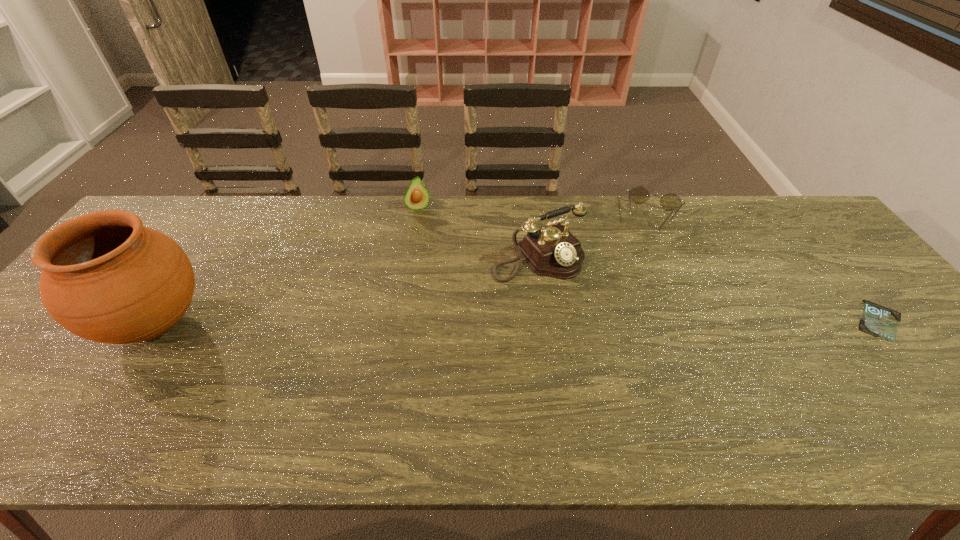
The width and height of the screenshot is (960, 540). I want to click on free space between the telephone and the leftmost object, so click(347, 290).

The image size is (960, 540). Identify the location of object identified as the third closest to the fourth object from left to right. (416, 197).

Select which object appears as the third closest to the third tallest object. Please provide its 2D coordinates. Your answer should be formatted as a tuple, i.e. [(x, y)], where the tuple contains the x and y coordinates of a point satisfying the conditions above.

[(639, 194)]

Find the location of a particular element. The width and height of the screenshot is (960, 540). vacant region that satisfies the following two spatial constraints: 1. on the back side of the leftmost object; 2. on the left side of the fourth object from right to left is located at coordinates (232, 207).

The height and width of the screenshot is (540, 960). In order to click on vacant region that satisfies the following two spatial constraints: 1. on the front side of the third tallest object; 2. on the left side of the fourth shortest object in this screenshot , I will do `click(410, 256)`.

Locate an element on the screen. This screenshot has width=960, height=540. vacant region that satisfies the following two spatial constraints: 1. on the back side of the second tallest object; 2. on the left side of the second object from right to left is located at coordinates (533, 216).